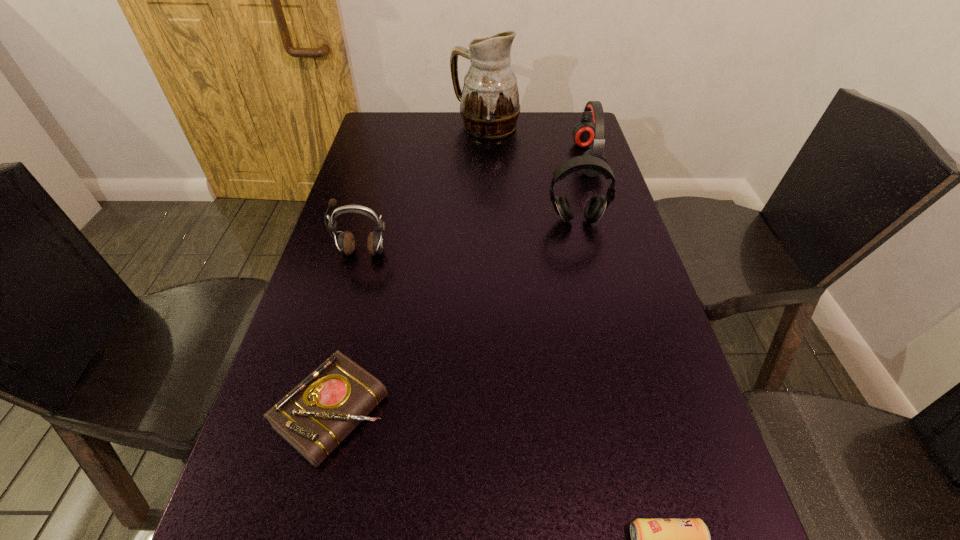
This screenshot has height=540, width=960. In order to click on diary that is at the left edge in this screenshot , I will do `click(320, 412)`.

I want to click on object that is at the far right corner, so click(x=584, y=133).

This screenshot has height=540, width=960. Identify the location of vacant area at the left edge. (283, 479).

In the image, there is a desktop. Find the location of `blank space at the right edge`. blank space at the right edge is located at coordinates (621, 287).

I want to click on free space at the far left corner of the desktop, so click(384, 113).

Find the location of `free space at the far right corner`. free space at the far right corner is located at coordinates (571, 114).

You are a GUI agent. You are given a task and a screenshot of the screen. Output one action in this format:
    pyautogui.click(x=<x>, y=<y>)
    Task: Click on the blank region between the fifth nearest object and the diary
    
    Given the screenshot: What is the action you would take?
    pyautogui.click(x=460, y=286)

At what (x,y) coordinates should I click in order to perform the action: click on vacant region between the fourth farthest object and the diary. Please return your answer as a coordinate pair (x, y). The height and width of the screenshot is (540, 960). Looking at the image, I should click on (348, 332).

The image size is (960, 540). In order to click on free spot between the farthest earphone and the second farthest earphone in this screenshot , I will do `click(582, 190)`.

Find the location of a particular element. The image size is (960, 540). vacant point located between the third farthest object and the farthest object is located at coordinates coord(531,173).